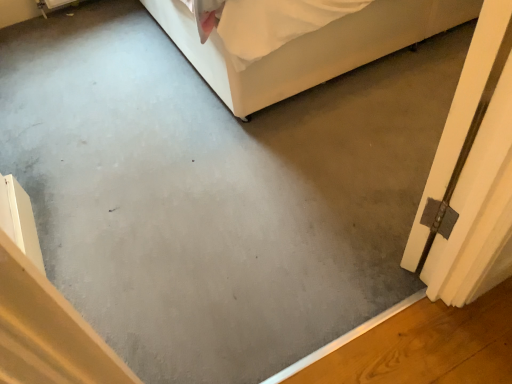
What do you see at coordinates (474, 173) in the screenshot? The image size is (512, 384). I see `metallic silver hinge at right` at bounding box center [474, 173].

Where is `metallic silver hinge at right`? The image size is (512, 384). metallic silver hinge at right is located at coordinates (474, 173).

This screenshot has width=512, height=384. What do you see at coordinates (309, 47) in the screenshot?
I see `white fabric bed at upper center` at bounding box center [309, 47].

You are a GUI agent. You are given a task and a screenshot of the screen. Output one action in this format:
    pyautogui.click(x=<x>, y=<y>)
    Task: Click on the white fabric bed at upper center
    The height and width of the screenshot is (384, 512).
    Given the screenshot: What is the action you would take?
    pyautogui.click(x=309, y=47)

Where is `metallic silver hinge at right`? metallic silver hinge at right is located at coordinates (474, 173).

Can you confirm if white fabric bed at upper center is positioned to the right of metallic silver hinge at right?

No.

Does white fabric bed at upper center come in front of metallic silver hinge at right?

No, the depth of white fabric bed at upper center is greater than that of metallic silver hinge at right.

Which is in front, point (190, 46) or point (475, 101)?

The point (475, 101) is in front.

From the image's perspective, is white fabric bed at upper center above or below metallic silver hinge at right?

Based on their image positions, white fabric bed at upper center is located above metallic silver hinge at right.

From a real-world perspective, is white fabric bed at upper center positioned under metallic silver hinge at right based on gravity?

Indeed, from a real-world perspective, white fabric bed at upper center is positioned beneath metallic silver hinge at right.

Considering the sizes of objects white fabric bed at upper center and metallic silver hinge at right in the image provided, who is wider, white fabric bed at upper center or metallic silver hinge at right?

white fabric bed at upper center is wider.

Is white fabric bed at upper center shorter than metallic silver hinge at right?

Correct, white fabric bed at upper center is not as tall as metallic silver hinge at right.

Looking at this image, considering the sizes of objects white fabric bed at upper center and metallic silver hinge at right in the image provided, who is smaller, white fabric bed at upper center or metallic silver hinge at right?

metallic silver hinge at right.

In the scene shown: Is white fabric bed at upper center inside the boundaries of metallic silver hinge at right, or outside?

white fabric bed at upper center is spatially situated outside metallic silver hinge at right.

Is white fabric bed at upper center next to metallic silver hinge at right and touching it?

No, white fabric bed at upper center is not touching metallic silver hinge at right.

Is white fabric bed at upper center looking in the opposite direction of metallic silver hinge at right?

No, white fabric bed at upper center is not facing the opposite direction of metallic silver hinge at right.

Measure the distance between white fabric bed at upper center and metallic silver hinge at right.

39.05 inches.

The width and height of the screenshot is (512, 384). Identify the location of screen door in front of the white fabric bed at upper center. (474, 173).

Considering the relative positions of metallic silver hinge at right and white fabric bed at upper center in the image provided, is metallic silver hinge at right to the left of white fabric bed at upper center from the viewer's perspective?

No, metallic silver hinge at right is not to the left of white fabric bed at upper center.

Considering their positions, is metallic silver hinge at right located in front of or behind white fabric bed at upper center?

In the image, metallic silver hinge at right appears in front of white fabric bed at upper center.

Which is more distant, (461, 172) or (257, 81)?

Point (257, 81)

From the image's perspective, is metallic silver hinge at right above or below white fabric bed at upper center?

metallic silver hinge at right is situated lower than white fabric bed at upper center in the image.

From a real-world perspective, who is located higher, metallic silver hinge at right or white fabric bed at upper center?

metallic silver hinge at right.

Based on the photo, is metallic silver hinge at right wider than white fabric bed at upper center?

No.

Is metallic silver hinge at right shorter than white fabric bed at upper center?

No, metallic silver hinge at right is not shorter than white fabric bed at upper center.

Who is smaller, metallic silver hinge at right or white fabric bed at upper center?

metallic silver hinge at right.

Would you say metallic silver hinge at right is inside or outside white fabric bed at upper center?

metallic silver hinge at right is not inside white fabric bed at upper center, it's outside.

Is metallic silver hinge at right placed right next to white fabric bed at upper center?

metallic silver hinge at right is not next to white fabric bed at upper center, and they're not touching.

Is metallic silver hinge at right facing away from white fabric bed at upper center?

metallic silver hinge at right does not have its back to white fabric bed at upper center.

This screenshot has width=512, height=384. I want to click on screen door on the right side of white fabric bed at upper center, so click(x=474, y=173).

In the image, there is a metallic silver hinge at right. Identify the location of furniture above it (from the image's perspective). (309, 47).

The height and width of the screenshot is (384, 512). In order to click on screen door below the white fabric bed at upper center (from the image's perspective) in this screenshot , I will do `click(474, 173)`.